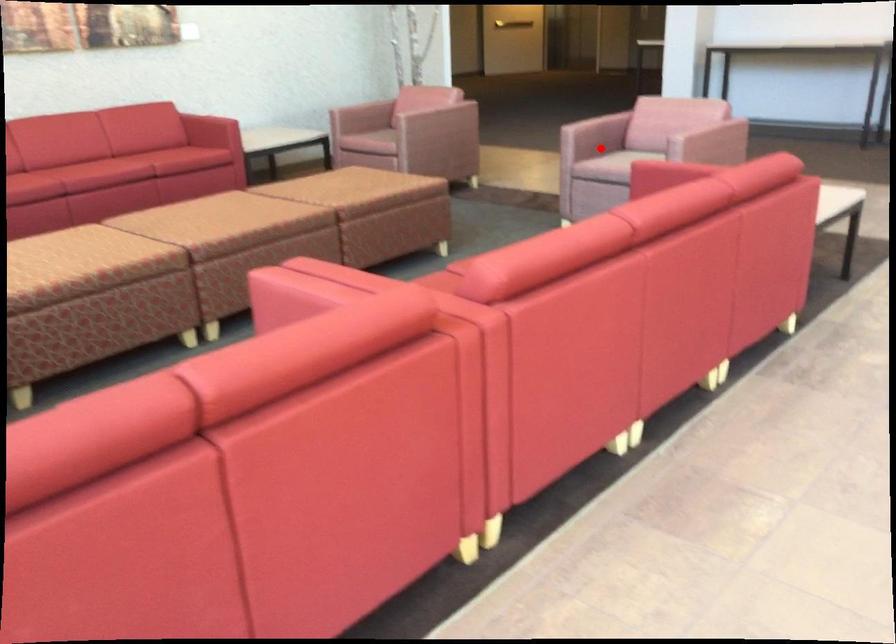
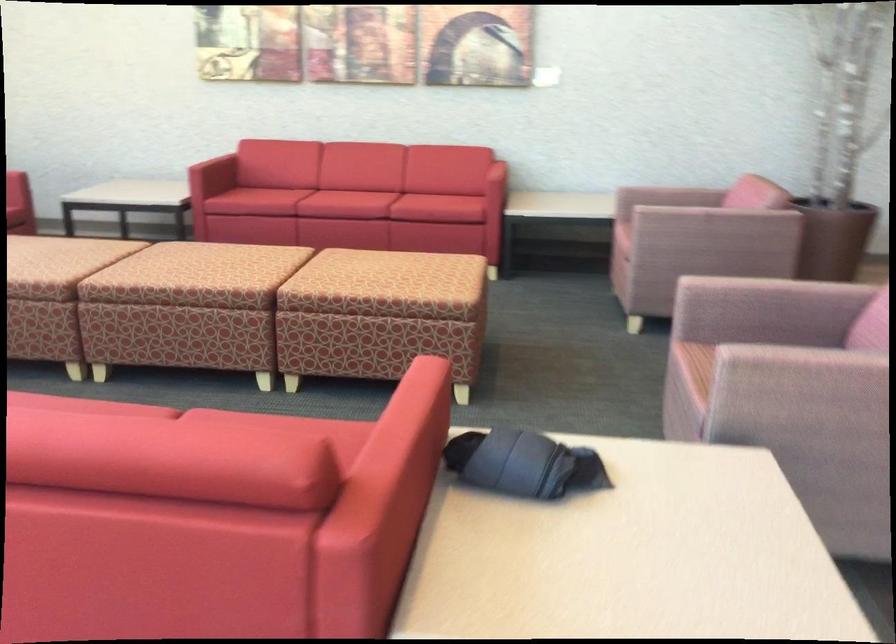
Question: I am providing you with two images of the same scene from different viewpoints. Given a red point in image1, look at the same physical point in image2. Is it:

Choices:
 (A) Closer to the viewpoint
 (B) Farther from the viewpoint

Answer: (A)